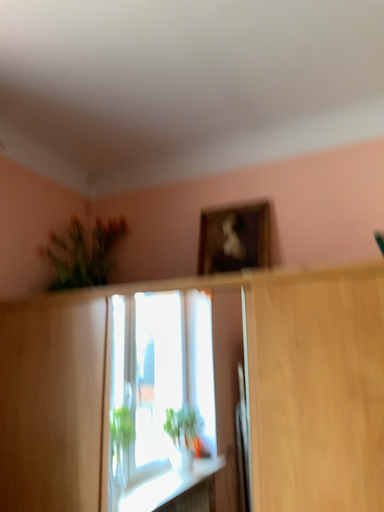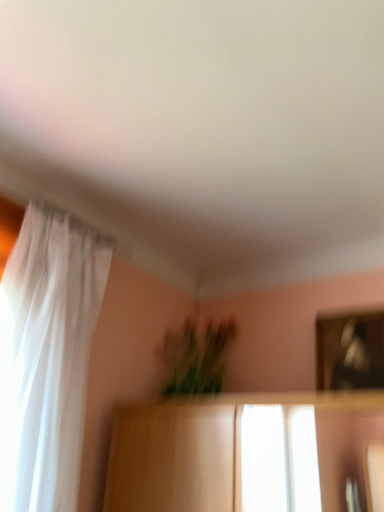
Question: Which way did the camera rotate in the video?

Choices:
 (A) rotated downward
 (B) rotated upward

Answer: (B)